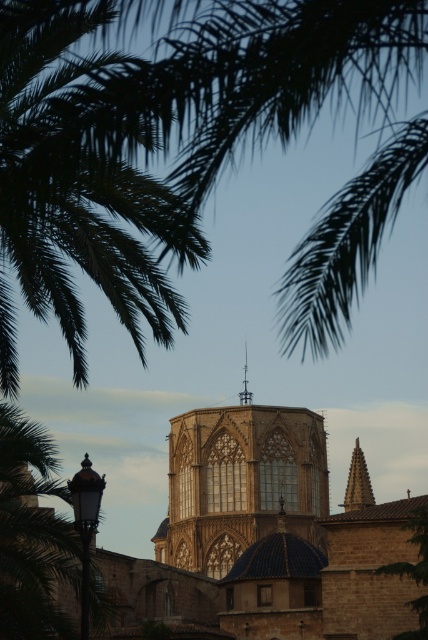
Does green leafy palm at upper left have a greater height compared to green leafy tree at lower right?

Correct, green leafy palm at upper left is much taller as green leafy tree at lower right.

What do you see at coordinates (77, 189) in the screenshot?
I see `green leafy palm at upper left` at bounding box center [77, 189].

The height and width of the screenshot is (640, 428). Describe the element at coordinates (77, 189) in the screenshot. I see `green leafy palm at upper left` at that location.

This screenshot has width=428, height=640. What are the coordinates of `green leafy palm at upper left` in the screenshot? It's located at [x=77, y=189].

Does green leafy palm at upper left appear on the left side of golden stone spire at center?

Indeed, green leafy palm at upper left is positioned on the left side of golden stone spire at center.

Who is shorter, green leafy palm at upper left or golden stone spire at center?

With less height is golden stone spire at center.

Does point (86, 218) come closer to viewer compared to point (356, 502)?

Yes, point (86, 218) is in front of point (356, 502).

Image resolution: width=428 pixels, height=640 pixels. What are the coordinates of `green leafy palm at upper left` in the screenshot? It's located at (77, 189).

Is point (172, 532) positioned before point (359, 492)?

Yes, it is in front of point (359, 492).

Who is shorter, golden stone tower at center or golden stone spire at center?

With less height is golden stone spire at center.

Locate an element on the screen. golden stone tower at center is located at coordinates (240, 483).

What are the coordinates of `golden stone tower at center` in the screenshot? It's located at (240, 483).